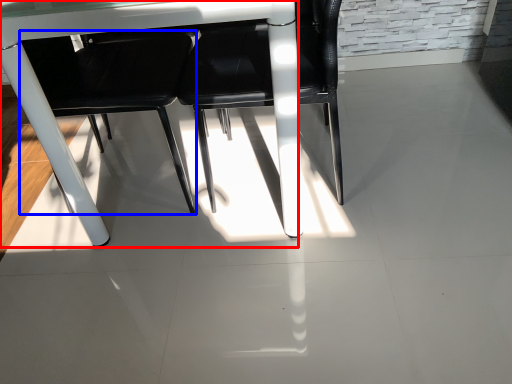
Question: Which object is closer to the camera taking this photo, table (highlighted by a red box) or chair (highlighted by a blue box)?

Choices:
 (A) table
 (B) chair

Answer: (A)